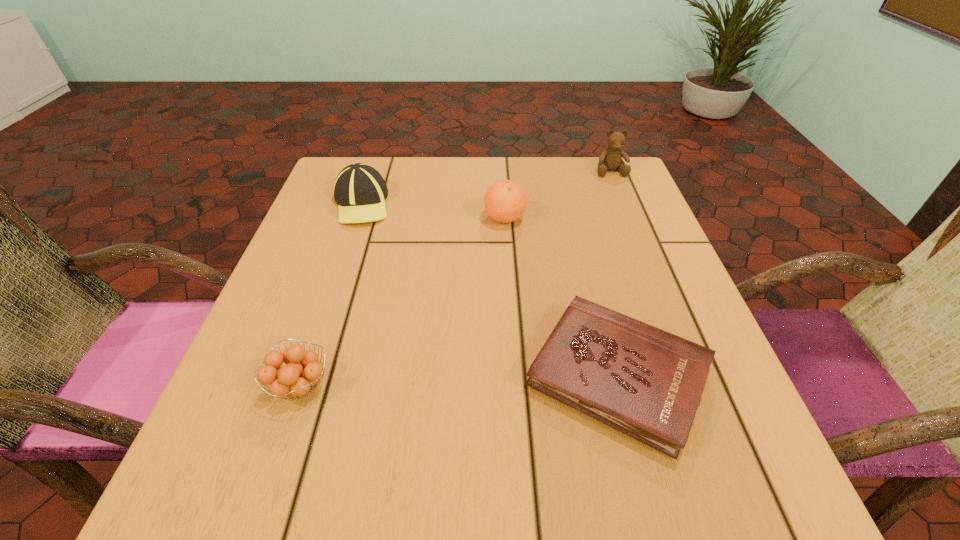
I want to click on vacant space located on the right of the shorter orange fruit, so click(443, 386).

Where is `free location located 0.180m on the back of the shortest object`? Image resolution: width=960 pixels, height=540 pixels. free location located 0.180m on the back of the shortest object is located at coordinates (583, 246).

The width and height of the screenshot is (960, 540). What are the coordinates of `teddy bear that is at the far edge` in the screenshot? It's located at tap(610, 159).

In order to click on orange situated at the far edge in this screenshot , I will do `click(505, 201)`.

Locate an element on the screen. baseball cap that is at the far edge is located at coordinates (360, 191).

The height and width of the screenshot is (540, 960). In order to click on object situated at the near edge in this screenshot , I will do `click(647, 383)`.

Identify the location of baseball cap present at the left edge. (360, 191).

The height and width of the screenshot is (540, 960). Identify the location of orange fruit that is positioned at the left edge. (295, 379).

Find the location of a particular element. Image resolution: width=960 pixels, height=540 pixels. teddy bear present at the right edge is located at coordinates (610, 159).

Identify the location of hardback book that is at the right edge. Image resolution: width=960 pixels, height=540 pixels. (647, 383).